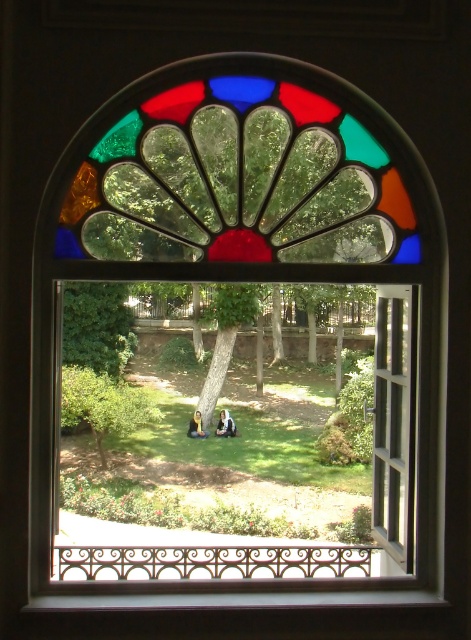
You are standing in a room with the decorative window described. You notice both the green leafy tree at center and the white fabric person at center through the window. Which object appears higher in the window frame?

The green leafy tree at center appears higher in the window frame than the white fabric person at center because the description states it is above the person.

In the scene shown: You are standing in front of the window and want to determine which of the two points, point [251,310] or point [193,422], is closer to you. Based on the window and garden scene described, which point is nearer to your position?

Point [251,310] is further to the viewer than point [193,422]. Therefore, point [193,422] is closer to you.

You are standing outside the window and want to walk towards the white fabric person at center. Which direction should you move relative to the green leafy tree at center?

Since the green leafy tree at center is to the left of the white fabric person at center, you should move to the right of the green leafy tree at center to reach the white fabric person at center.